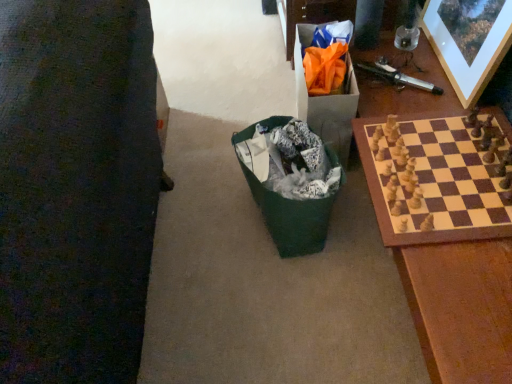
Question: In the image, is wooden chess set at right positioned in front of or behind orange paper bag at upper right?

Choices:
 (A) front
 (B) behind

Answer: (A)

Question: Is wooden chess set at right wider or thinner than orange paper bag at upper right?

Choices:
 (A) thin
 (B) wide

Answer: (B)

Question: Estimate the real-world distances between objects in this image. Which object is closer to the wooden chess set at right?

Choices:
 (A) green fabric bag at center
 (B) wooden picture frame at upper right
 (C) orange paper bag at upper right

Answer: (B)

Question: Considering the real-world distances, which object is farthest from the orange paper bag at upper right?

Choices:
 (A) green fabric bag at center
 (B) wooden chess set at right
 (C) wooden picture frame at upper right

Answer: (C)